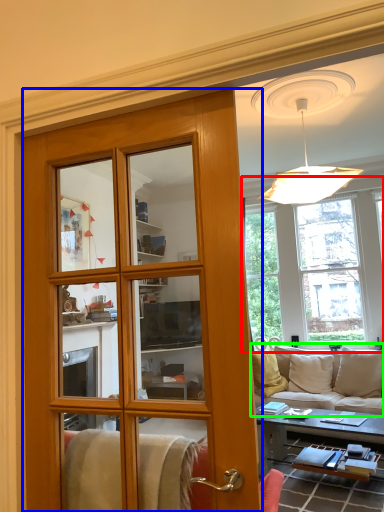
Question: Based on their relative distances, which object is farther from window (highlighted by a red box)? Choose from door (highlighted by a blue box) and studio couch (highlighted by a green box).

Choices:
 (A) door
 (B) studio couch

Answer: (A)